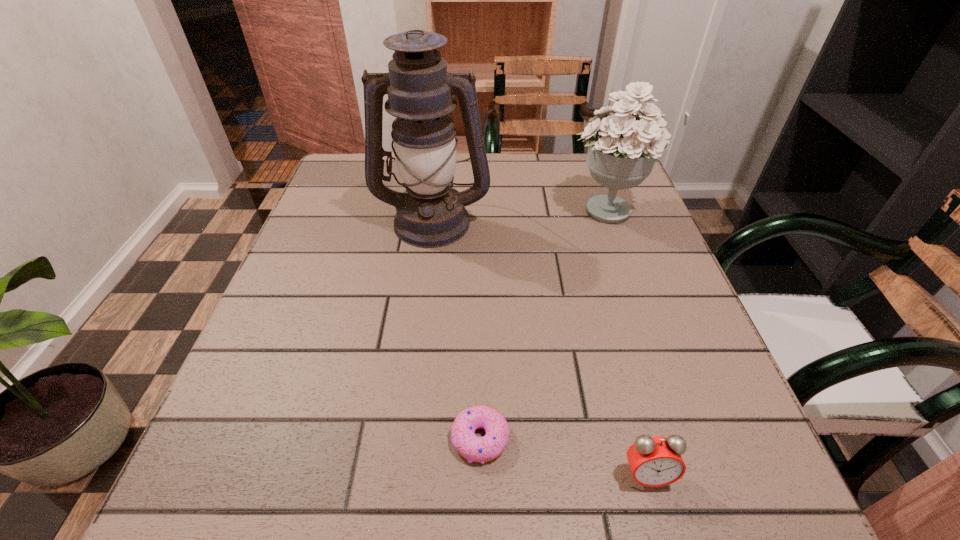
This screenshot has height=540, width=960. Identify the location of doughnut at the near edge. (473, 448).

Where is `object that is at the left edge`? object that is at the left edge is located at coordinates (430, 213).

This screenshot has height=540, width=960. In order to click on bouquet that is at the right edge in this screenshot , I will do `click(622, 149)`.

The height and width of the screenshot is (540, 960). I want to click on alarm clock located in the right edge section of the desktop, so click(655, 461).

Locate an element on the screen. The image size is (960, 540). object present at the far left corner is located at coordinates click(x=430, y=213).

The image size is (960, 540). Find the location of `object situated at the far right corner`. object situated at the far right corner is located at coordinates (622, 149).

Find the location of a particular element. object present at the near right corner is located at coordinates (655, 461).

This screenshot has height=540, width=960. Identify the location of free space at the far edge. (494, 187).

The height and width of the screenshot is (540, 960). I want to click on vacant space at the near edge of the desktop, so click(575, 459).

You are a GUI agent. You are given a task and a screenshot of the screen. Output one action in this format:
    pyautogui.click(x=<x>, y=<y>)
    Task: Click on the vacant space at the left edge of the desktop
    This screenshot has width=960, height=540.
    Given the screenshot: What is the action you would take?
    pyautogui.click(x=297, y=268)